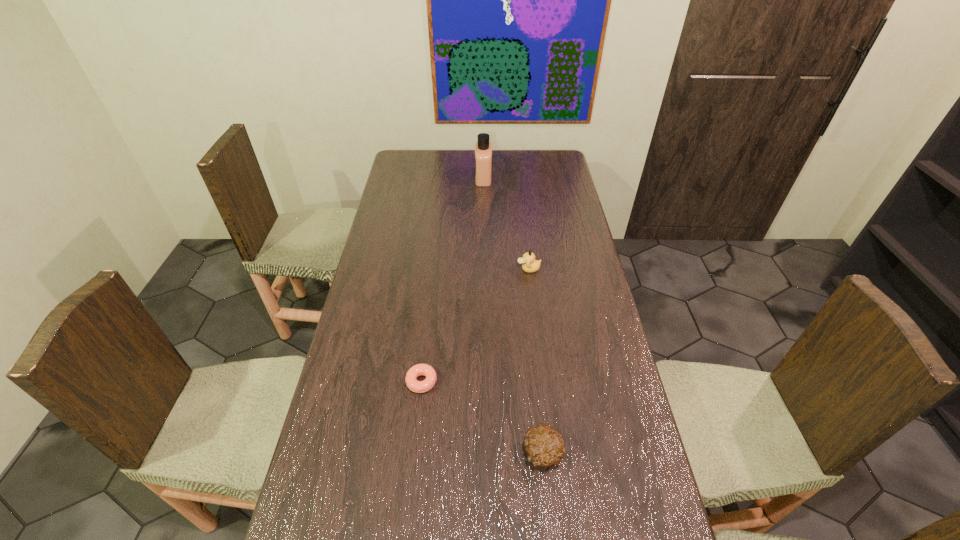
You are a GUI agent. You are given a task and a screenshot of the screen. Output one action in this format:
    pyautogui.click(x=<x>, y=<y>)
    Task: Click on the free spot between the tallest object and the doughnut
    The image size is (960, 540).
    Given the screenshot: What is the action you would take?
    pyautogui.click(x=452, y=280)

Where is `free space between the farthest object and the second farthest object`? This screenshot has width=960, height=540. free space between the farthest object and the second farthest object is located at coordinates (506, 224).

Where is `empty location between the farthest object and the duckling`? empty location between the farthest object and the duckling is located at coordinates (506, 224).

Where is `vacant point located between the duckling and the farthest object`? The width and height of the screenshot is (960, 540). vacant point located between the duckling and the farthest object is located at coordinates (506, 224).

The image size is (960, 540). I want to click on free space between the third object from right to left and the third tallest object, so click(x=513, y=315).

Where is `vacant point located between the doughnut and the second farthest object`? This screenshot has width=960, height=540. vacant point located between the doughnut and the second farthest object is located at coordinates (475, 326).

Identify the location of empty space that is in between the duckling and the farthest object. This screenshot has height=540, width=960. (506, 224).

You are a GUI agent. You are given a task and a screenshot of the screen. Output one action in this format:
    pyautogui.click(x=<x>, y=<y>)
    Task: Click on the free space between the second farthest object and the third object from right to left
    The image size is (960, 540).
    Given the screenshot: What is the action you would take?
    pyautogui.click(x=506, y=224)

In order to click on vacant area that lies between the second nearest object and the duckling in this screenshot , I will do `click(475, 326)`.

In order to click on object that is the second closest to the tallest object in this screenshot , I will do `click(413, 384)`.